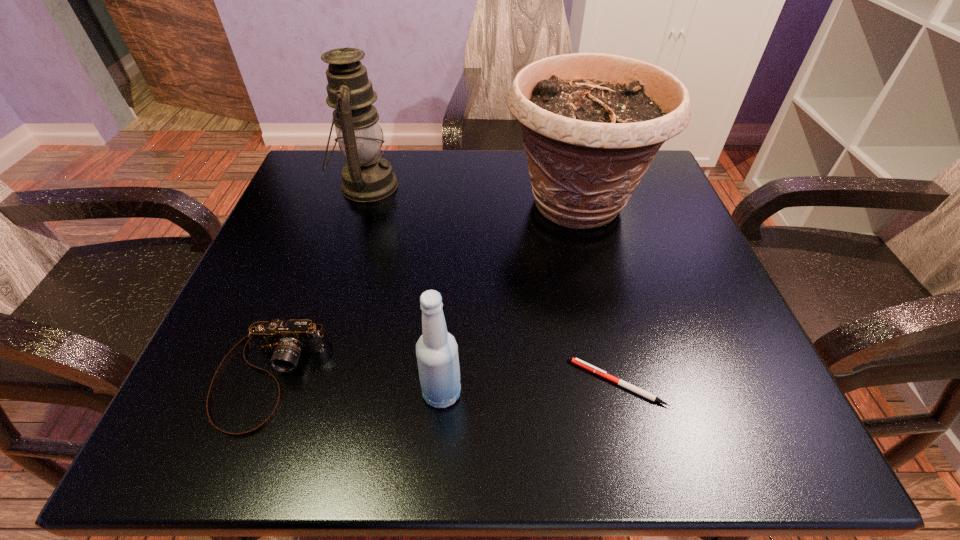
Identify the location of empty location between the oil lamp and the flowerpot. The height and width of the screenshot is (540, 960). (472, 195).

Find the location of a particular element. The height and width of the screenshot is (540, 960). free space between the fourth tallest object and the flowerpot is located at coordinates (423, 290).

Locate an element on the screen. empty location between the camera and the oil lamp is located at coordinates (318, 281).

I want to click on free space between the pen and the bottle, so click(529, 388).

The image size is (960, 540). Identify the location of unoccupied area between the flowerpot and the oil lamp. (472, 195).

Find the location of `free space between the oil lamp and the camera`. free space between the oil lamp and the camera is located at coordinates (318, 281).

This screenshot has width=960, height=540. Identify the location of unoccupied area between the oil lamp and the fourth tallest object. (318, 281).

The image size is (960, 540). What are the coordinates of `free point between the second shortest object and the third object from left to right` in the screenshot? It's located at (355, 384).

This screenshot has width=960, height=540. Identify the location of vacant space that's between the third object from right to left and the shortest object. (529, 388).

Locate an element on the screen. free space that is in between the third shortest object and the oil lamp is located at coordinates (404, 289).